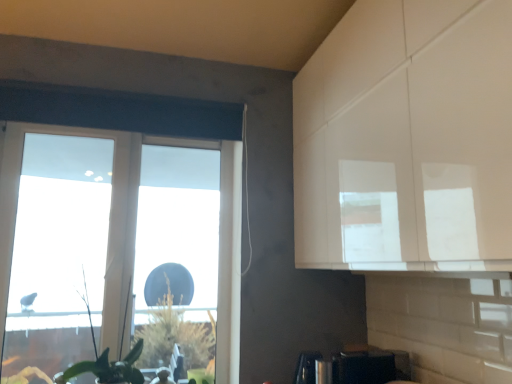
Question: From a real-world perspective, is satin black toaster at lower center beneath transparent plastic window at left?

Choices:
 (A) yes
 (B) no

Answer: (A)

Question: Does satin black toaster at lower center have a lesser width compared to transparent plastic window at left?

Choices:
 (A) yes
 (B) no

Answer: (B)

Question: Is transparent plastic window at left completely or partially inside satin black toaster at lower center?

Choices:
 (A) no
 (B) yes

Answer: (A)

Question: Is satin black toaster at lower center at the right side of transparent plastic window at left?

Choices:
 (A) no
 (B) yes

Answer: (B)

Question: From the image's perspective, is satin black toaster at lower center under transparent plastic window at left?

Choices:
 (A) yes
 (B) no

Answer: (A)

Question: Is transparent plastic window at left bigger or smaller than satin black toaster at lower center?

Choices:
 (A) small
 (B) big

Answer: (B)

Question: In terms of width, does transparent plastic window at left look wider or thinner when compared to satin black toaster at lower center?

Choices:
 (A) thin
 (B) wide

Answer: (A)

Question: In the image, is transparent plastic window at left on the left side or the right side of satin black toaster at lower center?

Choices:
 (A) left
 (B) right

Answer: (A)

Question: In terms of height, does transparent plastic window at left look taller or shorter compared to satin black toaster at lower center?

Choices:
 (A) short
 (B) tall

Answer: (B)

Question: Is satin black toaster at lower center inside or outside of green leafy plant at lower left?

Choices:
 (A) outside
 (B) inside

Answer: (A)

Question: From a real-world perspective, relative to green leafy plant at lower left, is satin black toaster at lower center vertically above or below?

Choices:
 (A) below
 (B) above

Answer: (A)

Question: Is satin black toaster at lower center taller or shorter than green leafy plant at lower left?

Choices:
 (A) short
 (B) tall

Answer: (A)

Question: Is satin black toaster at lower center wider or thinner than green leafy plant at lower left?

Choices:
 (A) wide
 (B) thin

Answer: (A)

Question: Considering the positions of satin black toaster at lower center and transparent plastic window at left in the image, is satin black toaster at lower center taller or shorter than transparent plastic window at left?

Choices:
 (A) short
 (B) tall

Answer: (A)

Question: From a real-world perspective, is satin black toaster at lower center positioned above or below transparent plastic window at left?

Choices:
 (A) below
 (B) above

Answer: (A)